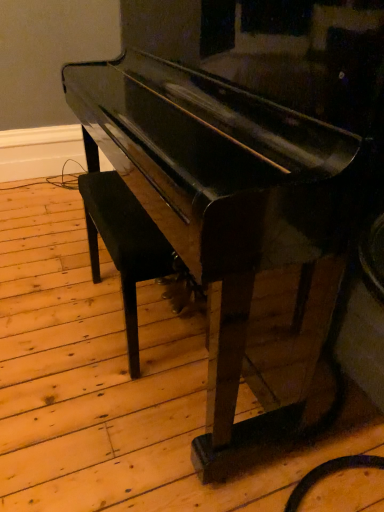
This screenshot has width=384, height=512. What are the coordinates of `black fabric chair at center` in the screenshot? It's located at [128, 246].

Image resolution: width=384 pixels, height=512 pixels. Describe the element at coordinates (128, 246) in the screenshot. I see `black fabric chair at center` at that location.

At what (x,y) coordinates should I click in order to perform the action: click on black fabric chair at center. Please return your answer as a coordinate pair (x, y). Image resolution: width=384 pixels, height=512 pixels. Looking at the image, I should click on (128, 246).